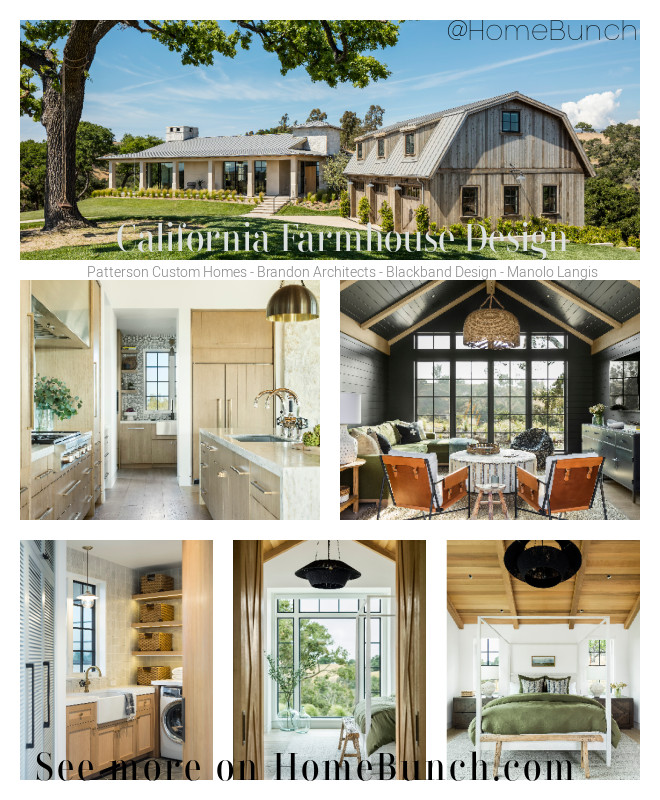
At what (x,y) coordinates should I click in order to perform the action: click on sink. Please return your answer as a coordinate pair (x, y). Looking at the image, I should click on (114, 694).